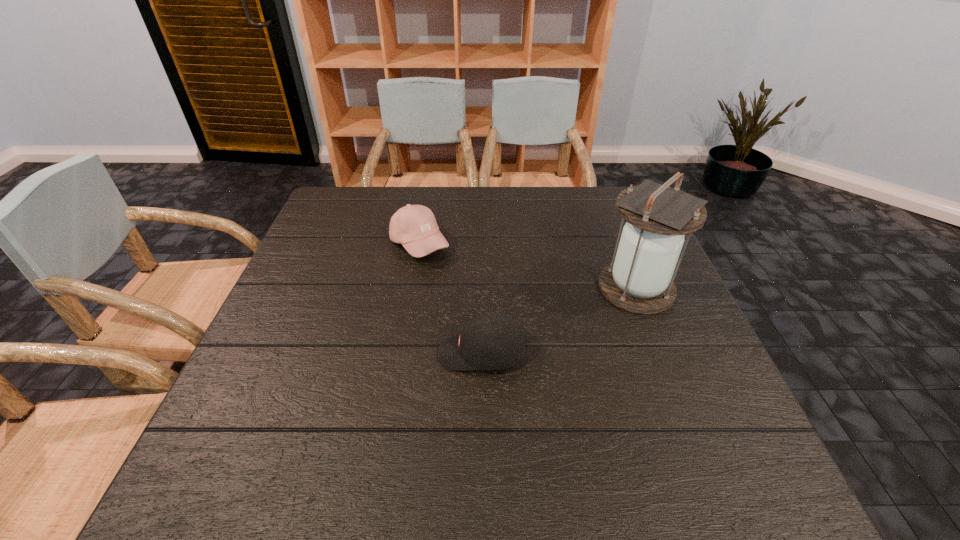
Identify the location of object present at the right edge. This screenshot has height=540, width=960. (639, 280).

At what (x,y) coordinates should I click in order to perform the action: click on free region at the far edge of the desktop. Please return your answer as a coordinate pair (x, y). The height and width of the screenshot is (540, 960). Looking at the image, I should click on (455, 217).

This screenshot has width=960, height=540. I want to click on vacant space at the left edge of the desktop, so click(335, 235).

You are a GUI agent. You are given a task and a screenshot of the screen. Output one action in this format:
    pyautogui.click(x=<x>, y=<y>)
    Task: Click on the vacant space at the right edge of the desktop
    
    Given the screenshot: What is the action you would take?
    pyautogui.click(x=684, y=325)

The image size is (960, 540). Find the location of `vacant space at the far left corner of the desktop`. vacant space at the far left corner of the desktop is located at coordinates (366, 209).

Find the location of a particular element. free space at the far right corner of the desktop is located at coordinates (597, 213).

The image size is (960, 540). I want to click on free space at the near right corner of the desktop, so click(679, 482).

I want to click on free space between the farther baseball cap and the nearest object, so click(451, 299).

Locate an element on the screen. The image size is (960, 540). vacant region between the lantern and the nearest object is located at coordinates (560, 321).

You are a GUI agent. You are given a task and a screenshot of the screen. Output one action in this format:
    pyautogui.click(x=<x>, y=<y>)
    Task: Click on the free space between the farther baseball cap and the rightmost object
    The image size is (960, 540).
    Given the screenshot: What is the action you would take?
    pyautogui.click(x=528, y=266)